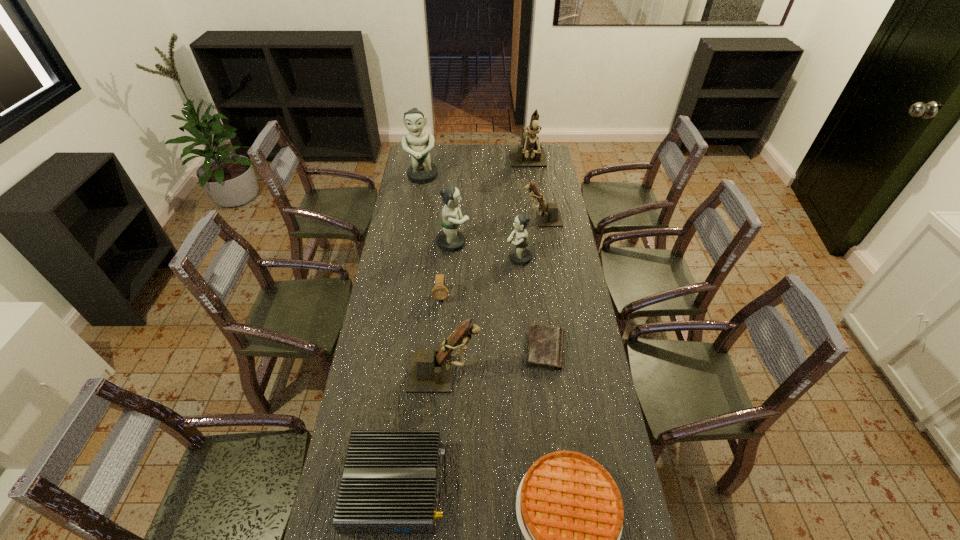
Where is `object that is at the far right corner`? Image resolution: width=960 pixels, height=540 pixels. object that is at the far right corner is located at coordinates (528, 154).

This screenshot has height=540, width=960. In the image, there is a desktop. In order to click on vacant area at the far edge in this screenshot , I will do `click(469, 151)`.

Locate an element on the screen. The image size is (960, 540). free spot at the left edge of the desktop is located at coordinates coord(386,305).

You are a GUI agent. You are given a task and a screenshot of the screen. Output one action in this format:
    pyautogui.click(x=<x>, y=<y>)
    Task: Click on the vacant space at the right edge of the desktop
    
    Given the screenshot: What is the action you would take?
    pyautogui.click(x=550, y=284)

In the image, there is a desktop. Where is `vacant space at the far right corner`? The width and height of the screenshot is (960, 540). vacant space at the far right corner is located at coordinates (545, 148).

This screenshot has height=540, width=960. In order to click on free space between the rightmost green figurine and the diary in this screenshot , I will do `click(532, 304)`.

The height and width of the screenshot is (540, 960). I want to click on empty space between the rightmost green figurine and the farthest brown figurine, so click(524, 211).

The image size is (960, 540). I want to click on vacant area between the smallest brown figurine and the second smallest green figurine, so click(x=497, y=231).

The width and height of the screenshot is (960, 540). Identify the location of vacant space that is in between the smallest green figurine and the third shortest object. (457, 372).

The image size is (960, 540). Find the location of `free area in between the rightmost green figurine and the second green figurine from right to left`. free area in between the rightmost green figurine and the second green figurine from right to left is located at coordinates point(486,251).